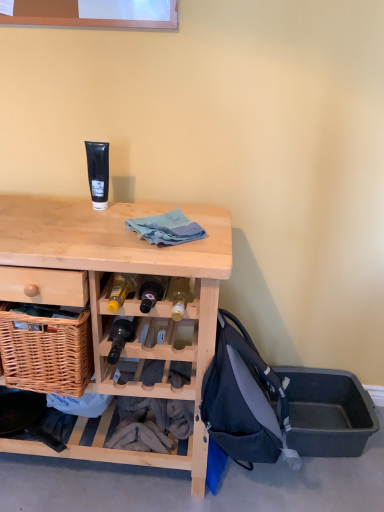
Locate an element on the screen. This screenshot has width=384, height=512. free space behind blue cotton cloth at center is located at coordinates (185, 211).